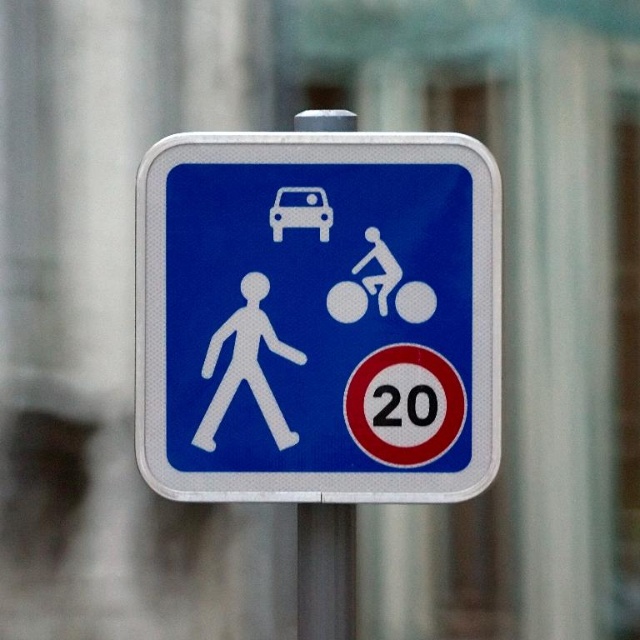
Question: Does silver metallic pole at center appear on the left side of white plastic car at upper center?

Choices:
 (A) no
 (B) yes

Answer: (A)

Question: Considering the real-world distances, which object is farthest from the white plastic car at upper center?

Choices:
 (A) silver metallic pole at center
 (B) white matte pedestrian at center
 (C) blue metallic sign at center

Answer: (A)

Question: Which of these objects is positioned closest to the blue metallic sign at center?

Choices:
 (A) silver metallic pole at center
 (B) white matte pedestrian at center

Answer: (B)

Question: Is silver metallic pole at center behind white matte pedestrian at center?

Choices:
 (A) no
 (B) yes

Answer: (B)

Question: Among these points, which one is nearest to the camera?

Choices:
 (A) (188, 168)
 (B) (220, 330)
 (C) (288, 189)

Answer: (B)

Question: Does blue metallic sign at center appear on the left side of white matte pedestrian at center?

Choices:
 (A) no
 (B) yes

Answer: (A)